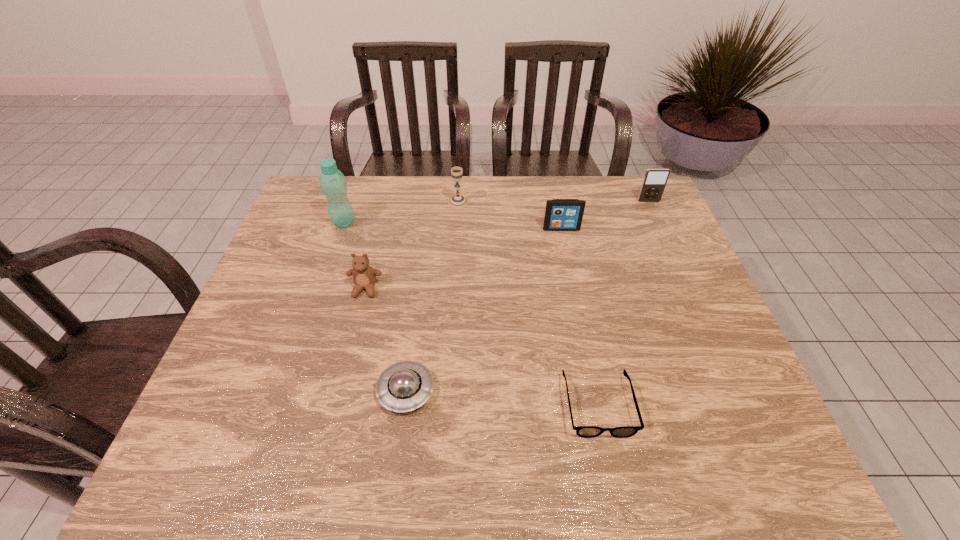
Where is `free space at the near left corner of the desktop`? The width and height of the screenshot is (960, 540). free space at the near left corner of the desktop is located at coordinates (252, 470).

The width and height of the screenshot is (960, 540). Find the location of `unoccupied area between the spectacles and the farther iPod`. unoccupied area between the spectacles and the farther iPod is located at coordinates (623, 303).

The image size is (960, 540). Find the location of `free area in between the chalice and the tallest object`. free area in between the chalice and the tallest object is located at coordinates (401, 212).

This screenshot has width=960, height=540. I want to click on unoccupied area between the saucer and the spectacles, so click(502, 397).

Where is `empty location between the right iPod and the bottle`? This screenshot has width=960, height=540. empty location between the right iPod and the bottle is located at coordinates (496, 212).

This screenshot has height=540, width=960. I want to click on free point between the saucer and the teddy bear, so click(386, 340).

At what (x,y) coordinates should I click in order to perform the action: click on unoccupied area between the chalice and the teddy bear. Please return your answer as a coordinate pair (x, y). Looking at the image, I should click on (412, 246).

Identify the location of empty space that is in between the chalice and the fifth farthest object. (412, 246).

The width and height of the screenshot is (960, 540). Identify the location of empty location between the bottle and the rightmost object. pos(496,212).

Point out which object is positioned as the third nearest to the chalice. Please provide its 2D coordinates. Your answer should be formatted as a tuple, i.e. [(x, y)], where the tuple contains the x and y coordinates of a point satisfying the conditions above.

[(364, 276)]